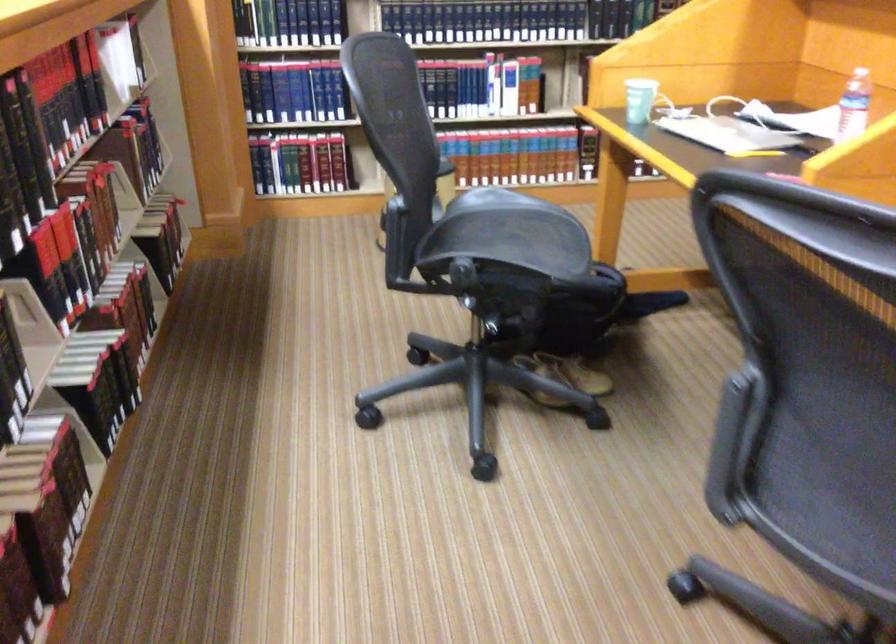
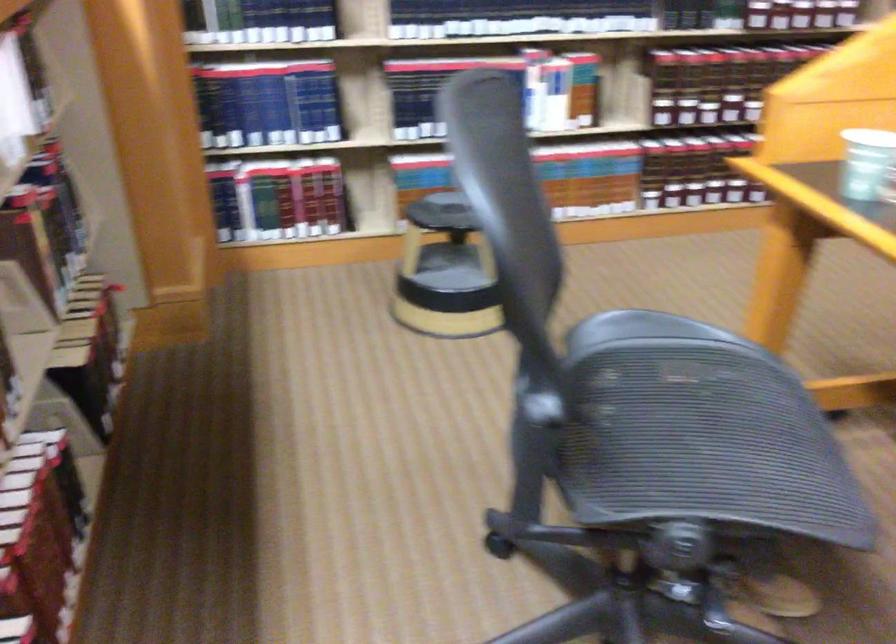
Question: What movement of the cameraman would produce the second image?

Choices:
 (A) Left
 (B) Right
 (C) Forward
 (D) Backward

Answer: (C)